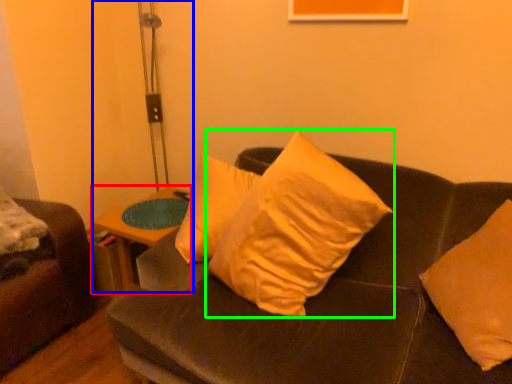
Question: Which object is positioned closest to table (highlighted by a red box)? Select from table lamp (highlighted by a blue box) and pillow (highlighted by a green box).

Choices:
 (A) table lamp
 (B) pillow

Answer: (B)